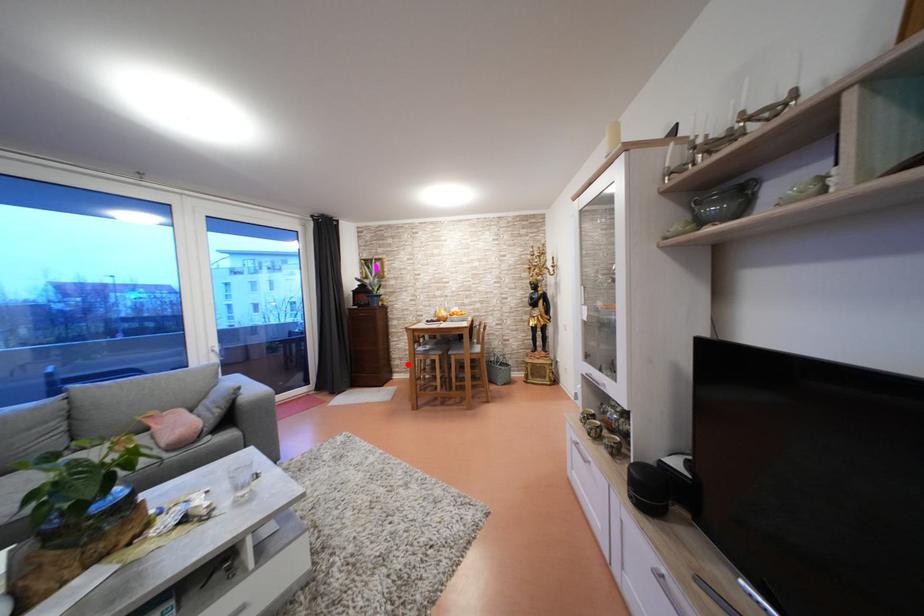
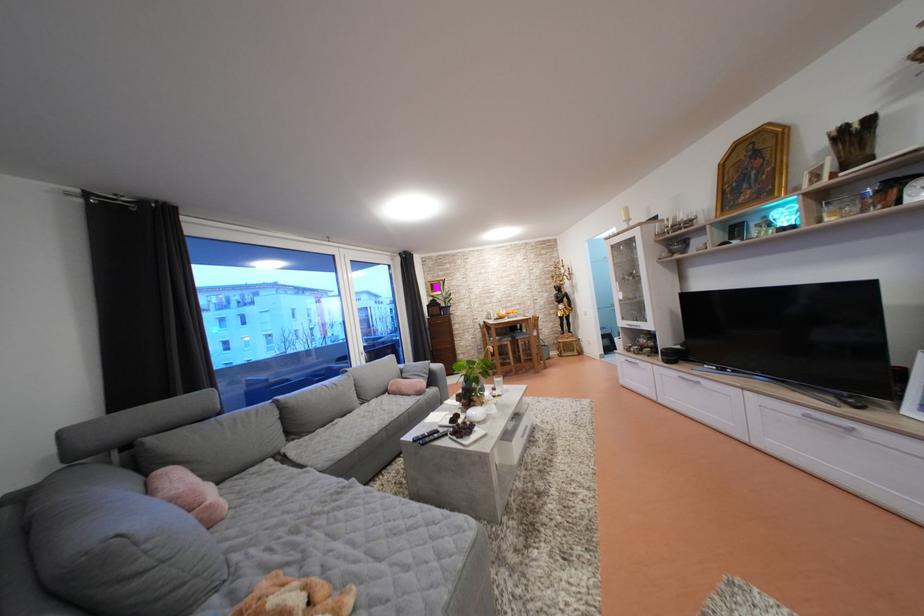
Find the pixel in the second image that matches the highlighted location in the first image.

(470, 359)